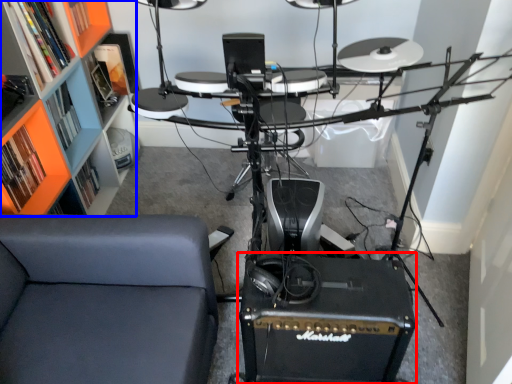
Question: Which of the following is the closest to the observer, speaker (highlighted by a red box) or shelf (highlighted by a blue box)?

Choices:
 (A) speaker
 (B) shelf

Answer: (B)